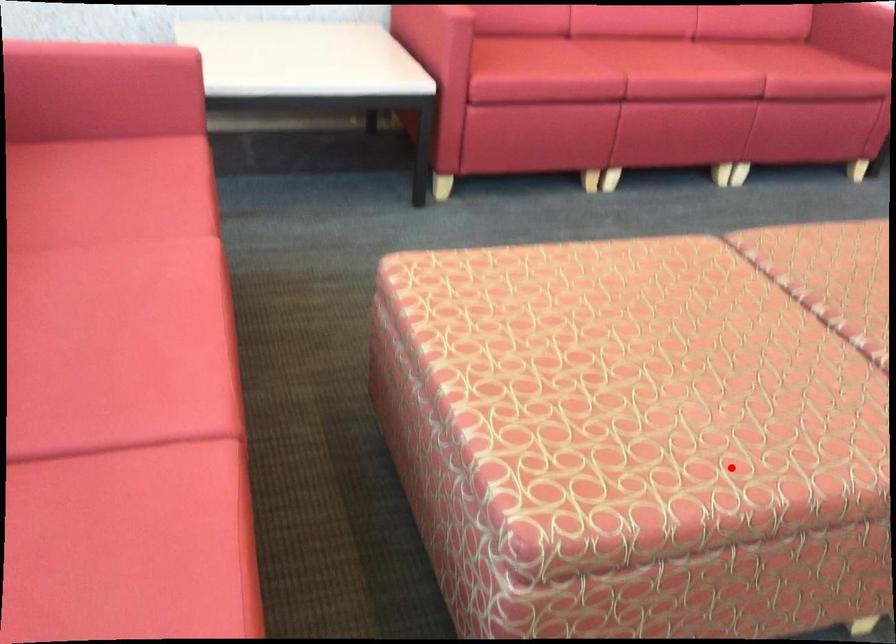
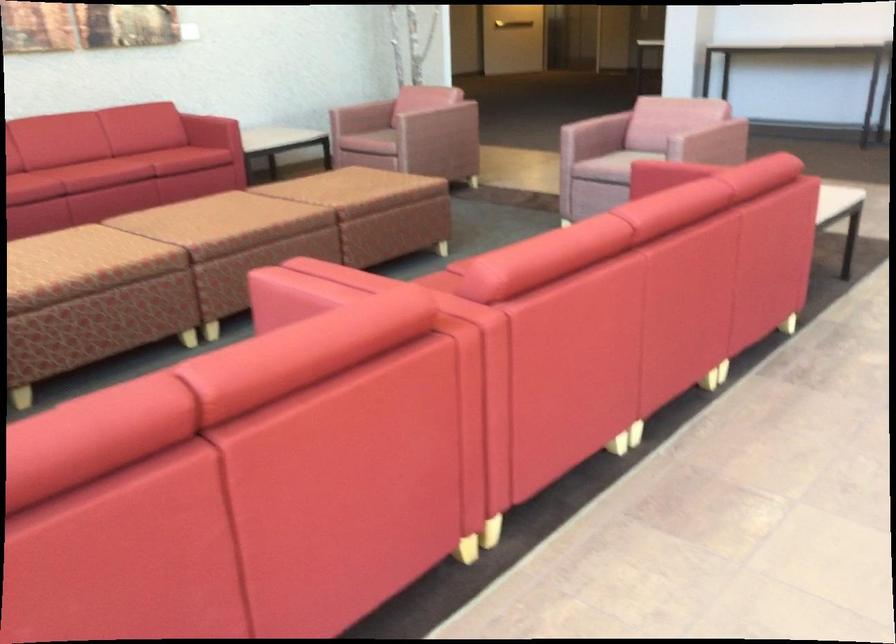
Question: I am providing you with two images of the same scene from different viewpoints. In image1, a red point is highlighted. Considering the same 3D point in image2, which of the following is correct?

Choices:
 (A) It is closer
 (B) It is farther

Answer: (B)